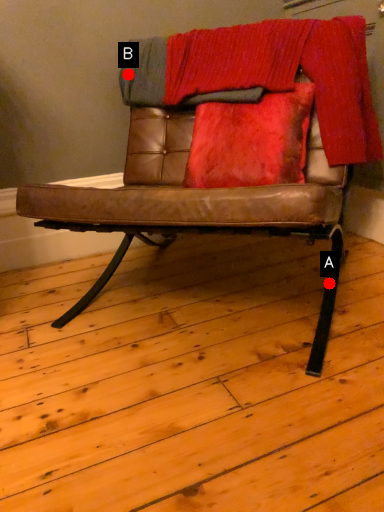
Question: Two points are circled on the image, labeled by A and B beside each circle. Which of the following is the closest to the observer?

Choices:
 (A) A is closer
 (B) B is closer

Answer: (A)